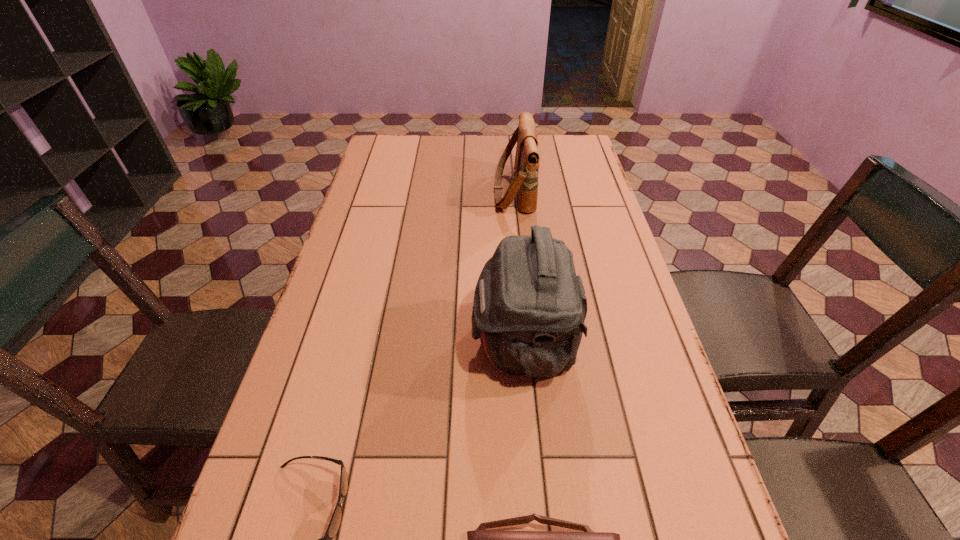
Where is `object that is positioned at the far edge`? The width and height of the screenshot is (960, 540). object that is positioned at the far edge is located at coordinates (525, 183).

In the image, there is a desktop. Where is `vacant space at the left edge`? This screenshot has width=960, height=540. vacant space at the left edge is located at coordinates (394, 205).

Where is `free space at the right edge of the desktop`? This screenshot has width=960, height=540. free space at the right edge of the desktop is located at coordinates (559, 181).

Identify the location of vacant region at the far right corner of the desktop. (571, 163).

Identify which object is the third nearest to the nearest shoulder bag. Please provide its 2D coordinates. Your answer should be formatted as a tuple, i.e. [(x, y)], where the tuple contains the x and y coordinates of a point satisfying the conditions above.

[(525, 183)]

Choose which object is the second nearest neighbor to the third nearest object. Please provide its 2D coordinates. Your answer should be formatted as a tuple, i.e. [(x, y)], where the tuple contains the x and y coordinates of a point satisfying the conditions above.

[(335, 521)]

Where is `the closest shoulder bag to the second farthest object`? the closest shoulder bag to the second farthest object is located at coordinates (480, 539).

Identify which shoulder bag is located as the third nearest to the sunglasses. Please provide its 2D coordinates. Your answer should be formatted as a tuple, i.e. [(x, y)], where the tuple contains the x and y coordinates of a point satisfying the conditions above.

[(525, 183)]